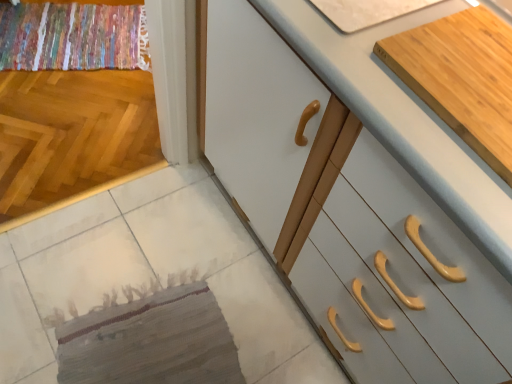
The height and width of the screenshot is (384, 512). Find the location of `light wood cutting board at upper right, which ranks as the first cabinetry in back-to-front order`. light wood cutting board at upper right, which ranks as the first cabinetry in back-to-front order is located at coordinates (462, 78).

This screenshot has width=512, height=384. Describe the element at coordinates (462, 78) in the screenshot. I see `light wood cutting board at upper right, which is the second cabinetry from front to back` at that location.

The width and height of the screenshot is (512, 384). What do you see at coordinates (360, 195) in the screenshot? I see `white glossy cabinet at center, which is the 2th cabinetry in back-to-front order` at bounding box center [360, 195].

Locate an element on the screen. This screenshot has height=384, width=512. multicolored woven rug at upper left is located at coordinates (72, 37).

Is the depth of multicolored woven rug at upper left greater than that of light wood cutting board at upper right, which is the second cabinetry from front to back?

Yes, it is behind light wood cutting board at upper right, which is the second cabinetry from front to back.

Considering the sizes of objects multicolored woven rug at upper left and light wood cutting board at upper right, which ranks as the first cabinetry in back-to-front order, in the image provided, who is smaller, multicolored woven rug at upper left or light wood cutting board at upper right, which ranks as the first cabinetry in back-to-front order,?

Smaller between the two is light wood cutting board at upper right, which ranks as the first cabinetry in back-to-front order.

Measure the distance between multicolored woven rug at upper left and light wood cutting board at upper right, which ranks as the first cabinetry in back-to-front order.

1.53 meters.

Is multicolored woven rug at upper left to the left of light wood cutting board at upper right, which ranks as the first cabinetry in back-to-front order, from the viewer's perspective?

Correct, you'll find multicolored woven rug at upper left to the left of light wood cutting board at upper right, which ranks as the first cabinetry in back-to-front order.

Considering the positions of points (438, 57) and (163, 363), is point (438, 57) farther from camera compared to point (163, 363)?

No, (438, 57) is in front of (163, 363).

Which object is more forward, light wood cutting board at upper right, which ranks as the first cabinetry in back-to-front order, or textured beige mat at lower left?

Positioned in front is light wood cutting board at upper right, which ranks as the first cabinetry in back-to-front order.

Is light wood cutting board at upper right, which is the second cabinetry from front to back, turned away from textured beige mat at lower left?

No.

How different are the orientations of light wood cutting board at upper right, which ranks as the first cabinetry in back-to-front order, and white glossy cabinet at center, which is the 2th cabinetry in back-to-front order, in degrees?

There is a 0.238-degree angle between the facing directions of light wood cutting board at upper right, which ranks as the first cabinetry in back-to-front order, and white glossy cabinet at center, which is the 2th cabinetry in back-to-front order.

Is light wood cutting board at upper right, which ranks as the first cabinetry in back-to-front order, not inside white glossy cabinet at center, which is the 2th cabinetry in back-to-front order?

No, light wood cutting board at upper right, which ranks as the first cabinetry in back-to-front order, is inside or overlapping with white glossy cabinet at center, which is the 2th cabinetry in back-to-front order.

Considering the sizes of light wood cutting board at upper right, which ranks as the first cabinetry in back-to-front order, and white glossy cabinet at center, the 1th cabinetry positioned from the front, in the image, is light wood cutting board at upper right, which ranks as the first cabinetry in back-to-front order, bigger or smaller than white glossy cabinet at center, the 1th cabinetry positioned from the front,?

Considering their sizes, light wood cutting board at upper right, which ranks as the first cabinetry in back-to-front order, takes up less space than white glossy cabinet at center, the 1th cabinetry positioned from the front.

Is light wood cutting board at upper right, which ranks as the first cabinetry in back-to-front order, shorter than white glossy cabinet at center, which is the 2th cabinetry in back-to-front order?

Yes.

In the scene shown: Which of these two, textured beige mat at lower left or white glossy cabinet at center, the 1th cabinetry positioned from the front, is wider?

With larger width is white glossy cabinet at center, the 1th cabinetry positioned from the front.

Is textured beige mat at lower left oriented towards white glossy cabinet at center, which is the 2th cabinetry in back-to-front order?

No, textured beige mat at lower left does not turn towards white glossy cabinet at center, which is the 2th cabinetry in back-to-front order.

Is white glossy cabinet at center, the 1th cabinetry positioned from the front, completely or partially inside textured beige mat at lower left?

No, white glossy cabinet at center, the 1th cabinetry positioned from the front, is not a part of textured beige mat at lower left.

Are textured beige mat at lower left and white glossy cabinet at center, the 1th cabinetry positioned from the front, located far from each other?

No, textured beige mat at lower left is not far from white glossy cabinet at center, the 1th cabinetry positioned from the front.

From the image's perspective, is textured beige mat at lower left below multicolored woven rug at upper left?

Indeed, from the image's perspective, textured beige mat at lower left is shown beneath multicolored woven rug at upper left.

Between textured beige mat at lower left and multicolored woven rug at upper left, which one has less height?

textured beige mat at lower left is shorter.

Relative to multicolored woven rug at upper left, is textured beige mat at lower left in front or behind?

textured beige mat at lower left is in front of multicolored woven rug at upper left.

I want to click on blanket located underneath the textured beige mat at lower left (from a real-world perspective), so click(72, 37).

Is there a large distance between white glossy cabinet at center, which is the 2th cabinetry in back-to-front order, and multicolored woven rug at upper left?

Absolutely, white glossy cabinet at center, which is the 2th cabinetry in back-to-front order, is distant from multicolored woven rug at upper left.

How different are the orientations of white glossy cabinet at center, the 1th cabinetry positioned from the front, and multicolored woven rug at upper left in degrees?

The angle between the facing direction of white glossy cabinet at center, the 1th cabinetry positioned from the front, and the facing direction of multicolored woven rug at upper left is 66.3 degrees.

Considering the positions of objects white glossy cabinet at center, the 1th cabinetry positioned from the front, and multicolored woven rug at upper left in the image provided, who is more to the left, white glossy cabinet at center, the 1th cabinetry positioned from the front, or multicolored woven rug at upper left?

Positioned to the left is multicolored woven rug at upper left.

From a real-world perspective, is white glossy cabinet at center, the 1th cabinetry positioned from the front, located higher than multicolored woven rug at upper left?

Yes, from a real-world perspective, white glossy cabinet at center, the 1th cabinetry positioned from the front, is above multicolored woven rug at upper left.

Considering the positions of point (139, 28) and point (253, 5), is point (139, 28) closer or farther from the camera than point (253, 5)?

Point (139, 28) is farther from the camera than point (253, 5).

From a real-world perspective, is multicolored woven rug at upper left above or below white glossy cabinet at center, the 1th cabinetry positioned from the front?

Clearly, from a real-world perspective, multicolored woven rug at upper left is below white glossy cabinet at center, the 1th cabinetry positioned from the front.

Identify the location of the 2nd cabinetry below the multicolored woven rug at upper left (from the image's perspective). This screenshot has width=512, height=384. coord(360,195).

Considering the sizes of objects multicolored woven rug at upper left and white glossy cabinet at center, which is the 2th cabinetry in back-to-front order, in the image provided, who is bigger, multicolored woven rug at upper left or white glossy cabinet at center, which is the 2th cabinetry in back-to-front order,?

white glossy cabinet at center, which is the 2th cabinetry in back-to-front order, is bigger.

Locate an element on the screen. The width and height of the screenshot is (512, 384). blanket located behind the light wood cutting board at upper right, which is the second cabinetry from front to back is located at coordinates (72, 37).

From a real-world perspective, which cabinetry is the 2nd one above the textured beige mat at lower left? Please provide its 2D coordinates.

[(462, 78)]

Looking at the image, which one is located further to multicolored woven rug at upper left, textured beige mat at lower left or light wood cutting board at upper right, which is the second cabinetry from front to back?

Among the two, light wood cutting board at upper right, which is the second cabinetry from front to back, is located further to multicolored woven rug at upper left.

Considering their positions, is textured beige mat at lower left positioned closer to white glossy cabinet at center, the 1th cabinetry positioned from the front, than multicolored woven rug at upper left?

textured beige mat at lower left lies closer to white glossy cabinet at center, the 1th cabinetry positioned from the front, than the other object.

From the image, which object appears to be farther from light wood cutting board at upper right, which ranks as the first cabinetry in back-to-front order, white glossy cabinet at center, which is the 2th cabinetry in back-to-front order, or textured beige mat at lower left?

Based on the image, textured beige mat at lower left appears to be further to light wood cutting board at upper right, which ranks as the first cabinetry in back-to-front order.

Based on their spatial positions, is light wood cutting board at upper right, which ranks as the first cabinetry in back-to-front order, or multicolored woven rug at upper left closer to textured beige mat at lower left?

Among the two, light wood cutting board at upper right, which ranks as the first cabinetry in back-to-front order, is located nearer to textured beige mat at lower left.

When comparing their distances from white glossy cabinet at center, which is the 2th cabinetry in back-to-front order, does multicolored woven rug at upper left or textured beige mat at lower left seem closer?

The object closer to white glossy cabinet at center, which is the 2th cabinetry in back-to-front order, is textured beige mat at lower left.

Based on their spatial positions, is light wood cutting board at upper right, which ranks as the first cabinetry in back-to-front order, or white glossy cabinet at center, the 1th cabinetry positioned from the front, closer to textured beige mat at lower left?

white glossy cabinet at center, the 1th cabinetry positioned from the front, is closer to textured beige mat at lower left.

Considering their positions, is multicolored woven rug at upper left positioned closer to textured beige mat at lower left than light wood cutting board at upper right, which ranks as the first cabinetry in back-to-front order?

light wood cutting board at upper right, which ranks as the first cabinetry in back-to-front order, is positioned closer to the anchor textured beige mat at lower left.

Looking at the image, which one is located closer to light wood cutting board at upper right, which ranks as the first cabinetry in back-to-front order, multicolored woven rug at upper left or textured beige mat at lower left?

Among the two, textured beige mat at lower left is located nearer to light wood cutting board at upper right, which ranks as the first cabinetry in back-to-front order.

Identify the location of mat between white glossy cabinet at center, the 1th cabinetry positioned from the front, and multicolored woven rug at upper left, along the z-axis. (151, 342).

Identify the location of cabinetry between white glossy cabinet at center, the 1th cabinetry positioned from the front, and multicolored woven rug at upper left from front to back. This screenshot has height=384, width=512. (462, 78).

This screenshot has width=512, height=384. In order to click on mat between multicolored woven rug at upper left and light wood cutting board at upper right, which ranks as the first cabinetry in back-to-front order, from left to right in this screenshot , I will do [x=151, y=342].

The height and width of the screenshot is (384, 512). What are the coordinates of `cabinetry between textured beige mat at lower left and light wood cutting board at upper right, which ranks as the first cabinetry in back-to-front order` in the screenshot? It's located at (360, 195).